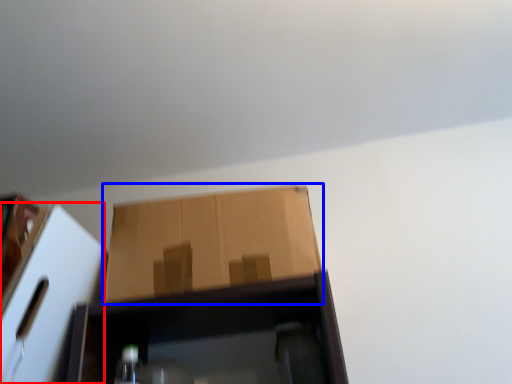
Question: Which object appears closest to the camera in this image, cardboard box (highlighted by a red box) or cardboard box (highlighted by a blue box)?

Choices:
 (A) cardboard box
 (B) cardboard box

Answer: (A)